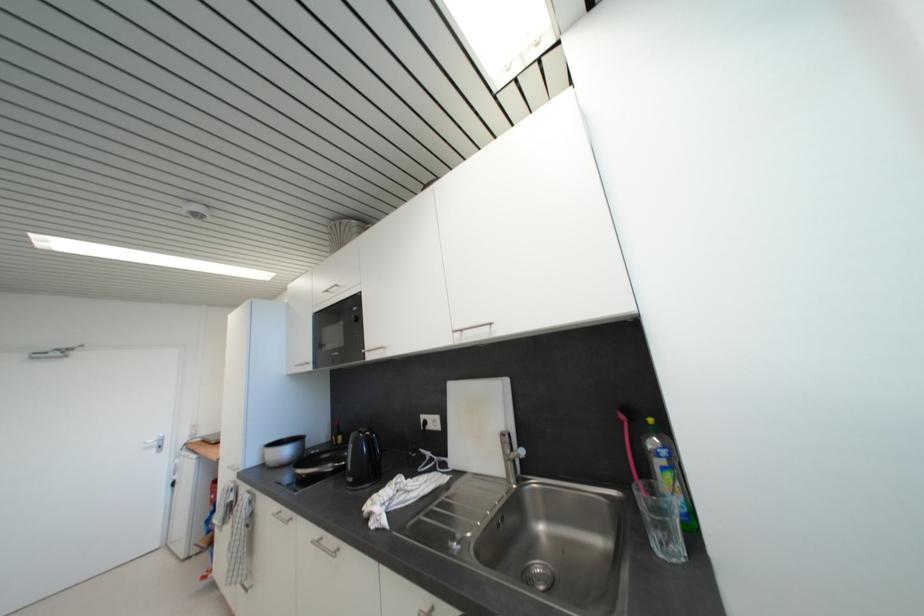
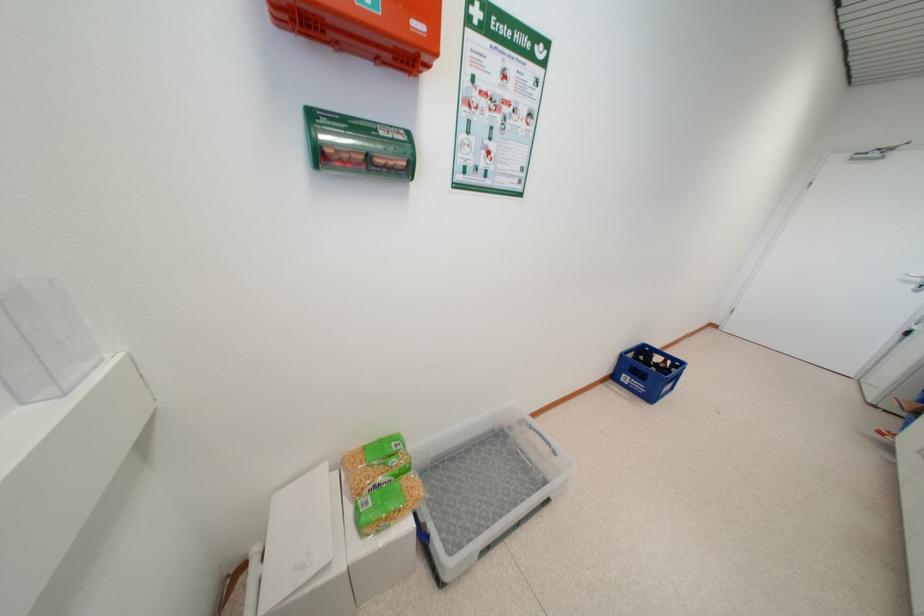
Find the pixel in the second image that matches pixel 154 450 in the first image.

(912, 284)